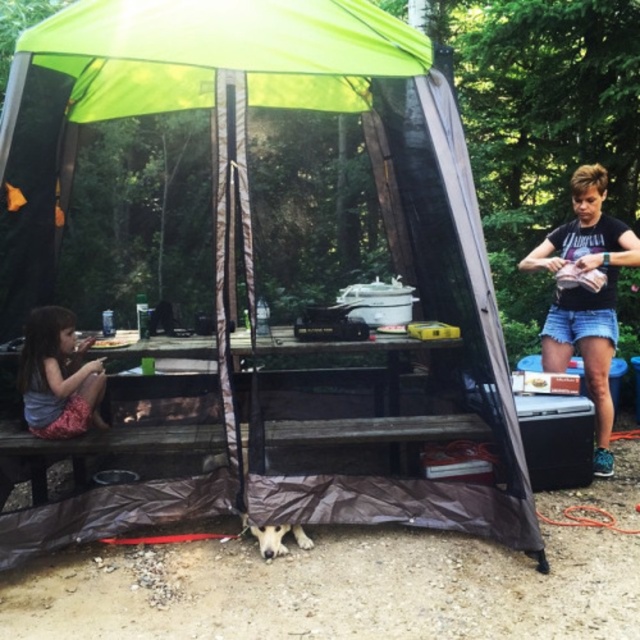
Question: Does black denim shorts at right appear on the right side of matte pink dress at lower left?

Choices:
 (A) yes
 (B) no

Answer: (A)

Question: Which point is farther from the camera taking this photo?

Choices:
 (A) (99, 362)
 (B) (579, 316)

Answer: (B)

Question: Among these objects, which one is nearest to the camera?

Choices:
 (A) black denim shorts at right
 (B) matte pink dress at lower left

Answer: (B)

Question: Does black denim shorts at right appear under matte pink dress at lower left?

Choices:
 (A) no
 (B) yes

Answer: (A)

Question: Which point is closer to the camera taking this photo?

Choices:
 (A) (604, 474)
 (B) (32, 348)

Answer: (B)

Question: From the image, what is the correct spatial relationship of black denim shorts at right in relation to matte pink dress at lower left?

Choices:
 (A) right
 (B) left

Answer: (A)